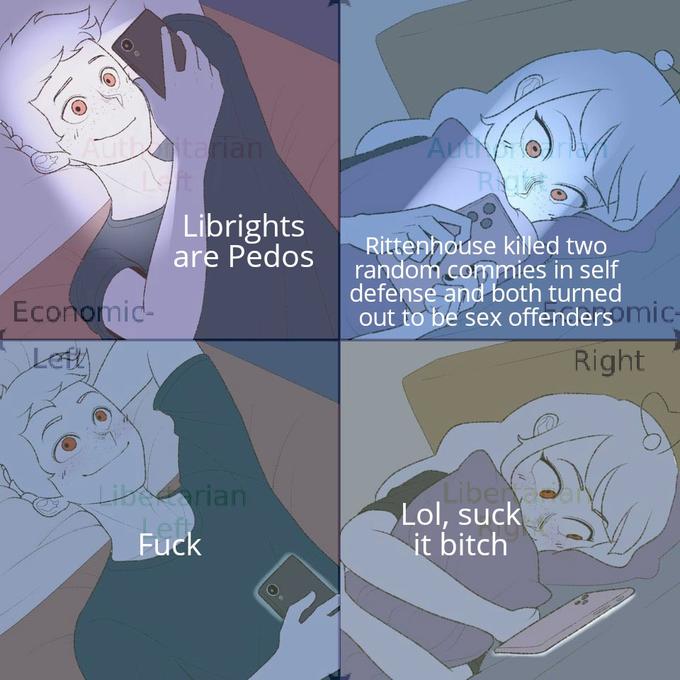
This screenshot has width=680, height=680. In order to click on light in this screenshot , I will do `click(124, 137)`.